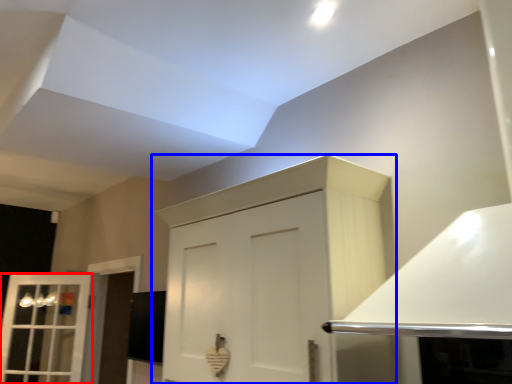
Question: Which of the following is the closest to the observer, window (highlighted by a red box) or cabinetry (highlighted by a blue box)?

Choices:
 (A) window
 (B) cabinetry

Answer: (B)